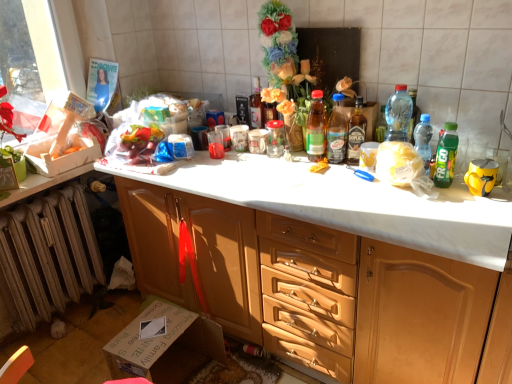
I want to click on free region on the left part of translucent plastic bottle at center, which is the 5th bottle from right to left, so click(x=290, y=164).